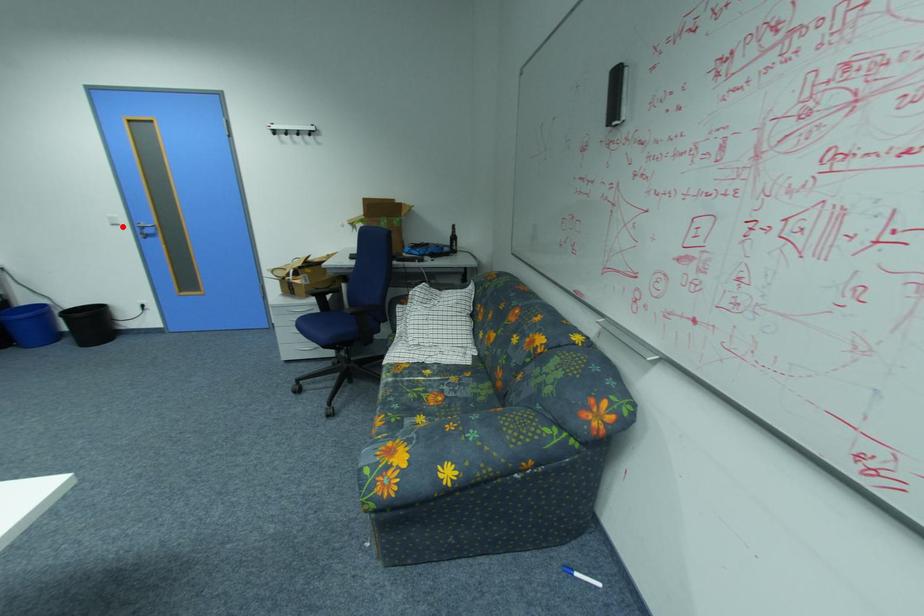
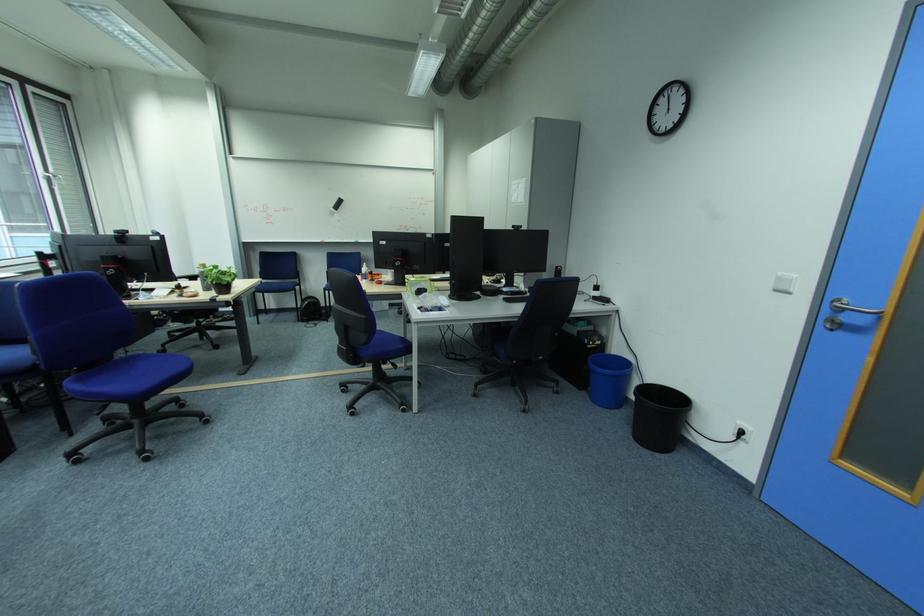
In the second image, find the point that corresponds to the highlighted location in the first image.

(785, 292)